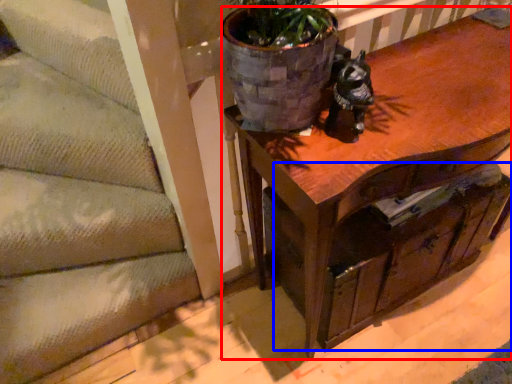
Question: Which point is closer to the camera, table (highlighted by a red box) or drawer (highlighted by a blue box)?

Choices:
 (A) table
 (B) drawer

Answer: (A)